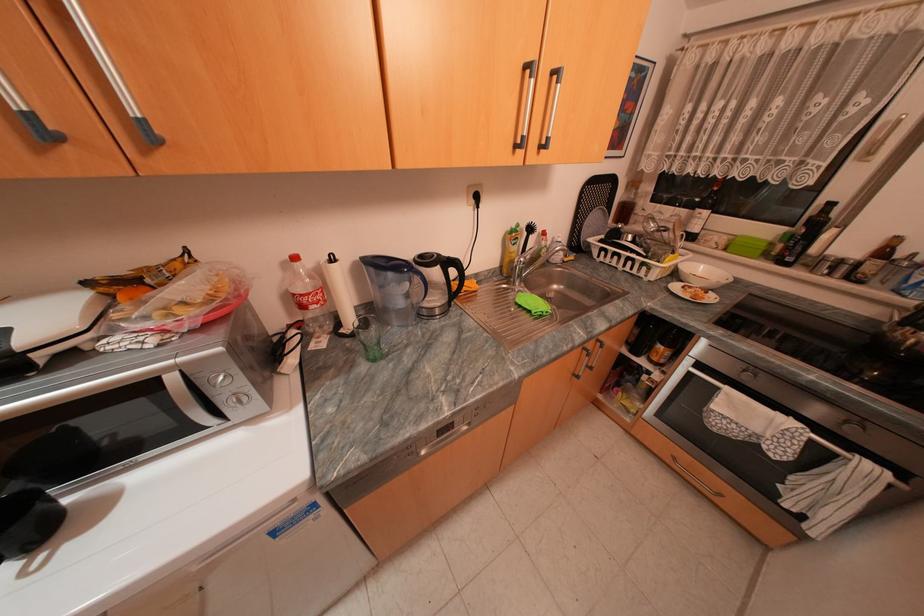
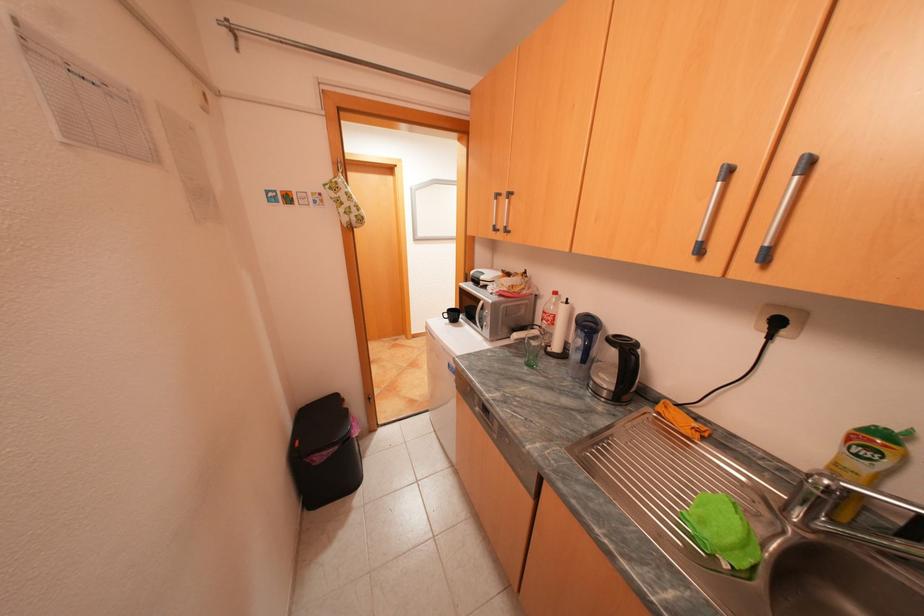
Where in the second image is the point corresponding to (521,235) from the first image?

(882, 439)